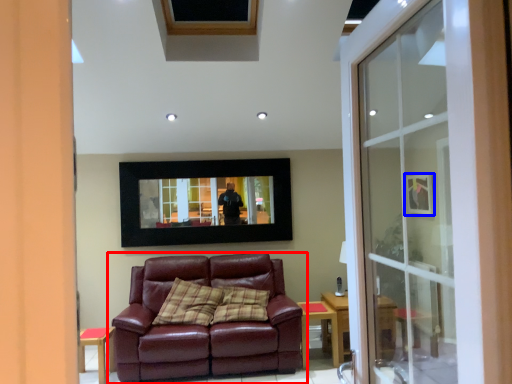
Question: Among these objects, which one is farthest to the camera, studio couch (highlighted by a red box) or picture frame (highlighted by a blue box)?

Choices:
 (A) studio couch
 (B) picture frame

Answer: (B)